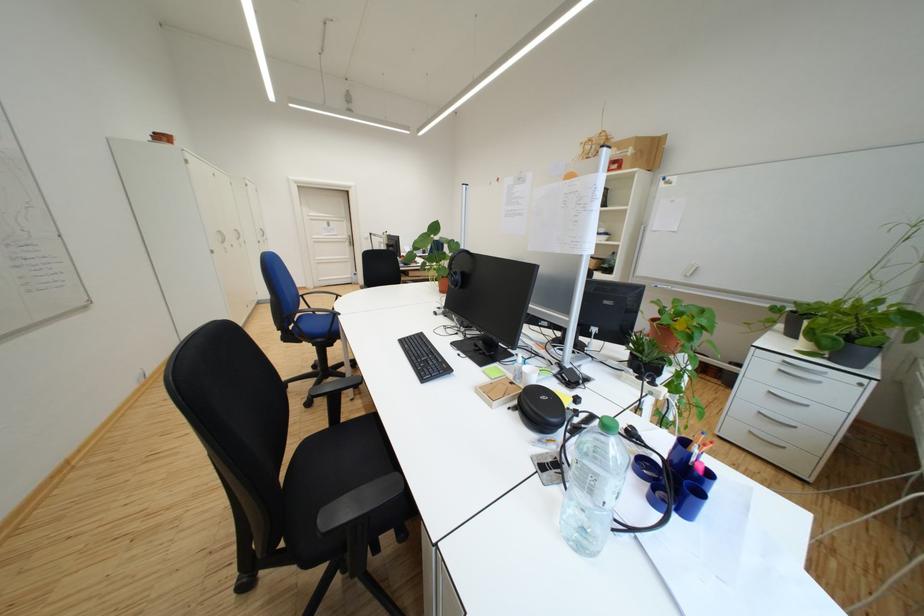
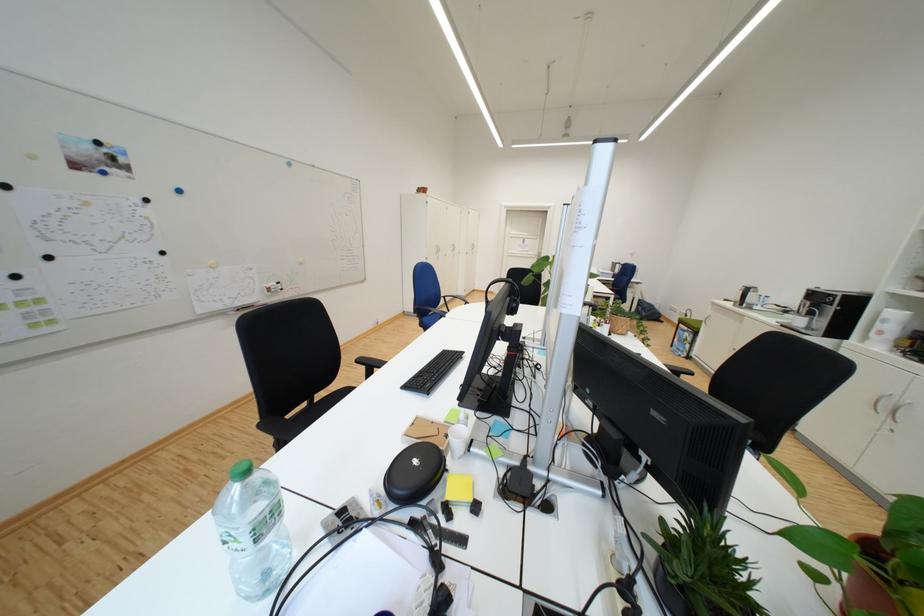
Question: How did the camera likely rotate?

Choices:
 (A) Left
 (B) Right
 (C) Up
 (D) Down

Answer: (A)